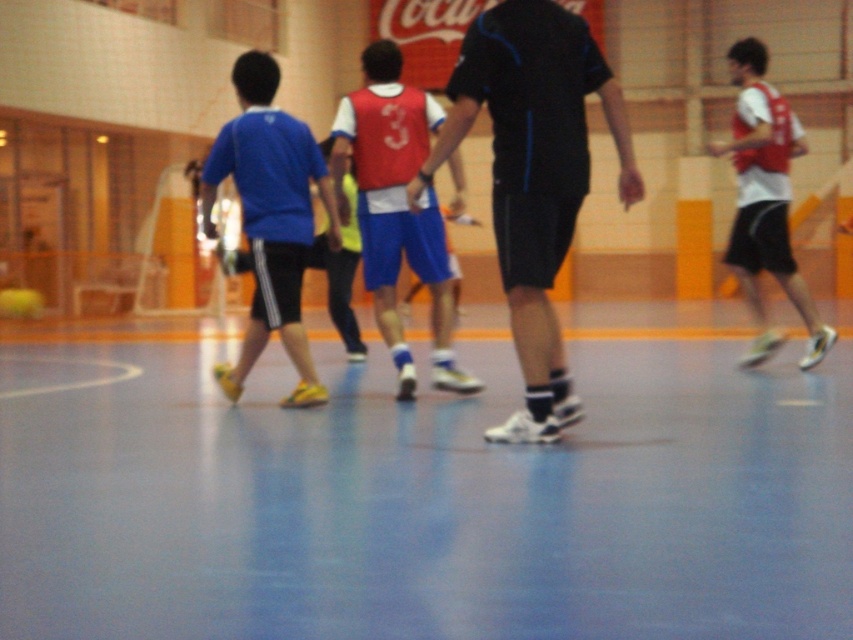
You are standing at the center of the gymnasium and see two points marked on the court. The first point is at coordinates point (260,173) and the second point is at point (775,204). Which point is closer to your current position?

Point (260,173) is closer to the camera than point (775,204), so the first point is closer to your current position.

You are a photographer positioned at the center of the gymnasium. You need to capture a photo that includes both the matte blue shorts at left and the white matte jersey at right. Which object should you adjust your camera angle to focus on first to ensure both are in frame?

The matte blue shorts at left is shorter than the white matte jersey at right. To ensure both are in frame, focus on the taller white matte jersey at right first, then adjust to include the shorter matte blue shorts at left.

You are a referee observing the game in the gymnasium. You notice two players near the center of the court. One is wearing black matte shorts at center and another is wearing white matte jersey at right. Which player is closer to the basketball hoop located at the far end of the court?

The black matte shorts at center is in front of white matte jersey at right, so the black matte shorts at center is closer to the basketball hoop located at the far end of the court.